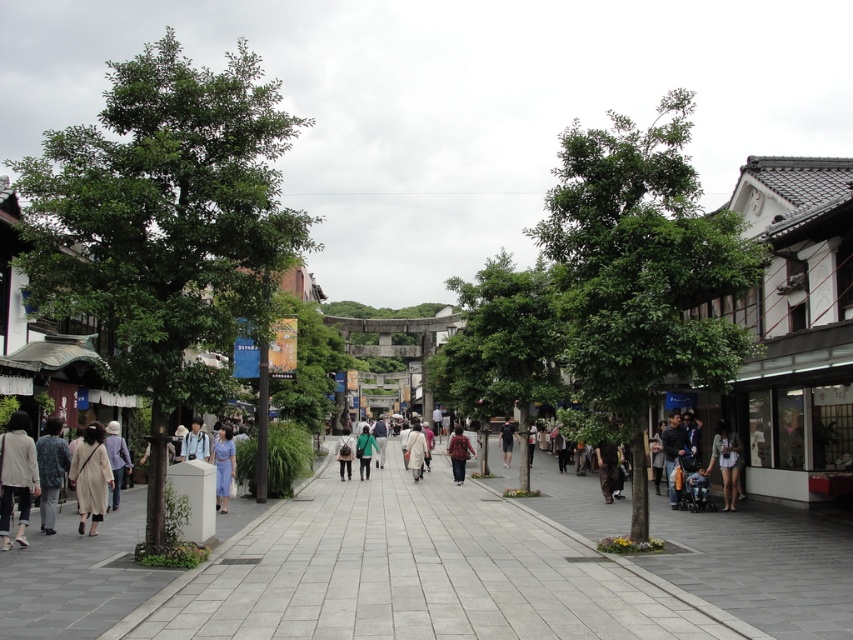
You are a delivery person standing at the starting point of the street. You need to deliver a package to a person wearing the light beige fabric dress at lower left and then to another person wearing the green matte jacket at center. What is the total distance you will travel between these two destinations?

The total distance between the light beige fabric dress at lower left and the green matte jacket at center is 31.76 meters, so you will travel 31.76 meters in total.

You are walking along the street and see a light beige fabric dress at lower left and a green matte jacket at center. Which one is closer to the left side of the street?

The light beige fabric dress at lower left is closer to the left side of the street because it is positioned to the left of the green matte jacket at center.

You are a tailor observing a person wearing both a plaid fabric shirt at center and a dark gray fabric jacket at center. Which piece of clothing is visible higher on the person?

The plaid fabric shirt at center is visible higher because it is above the dark gray fabric jacket at center.